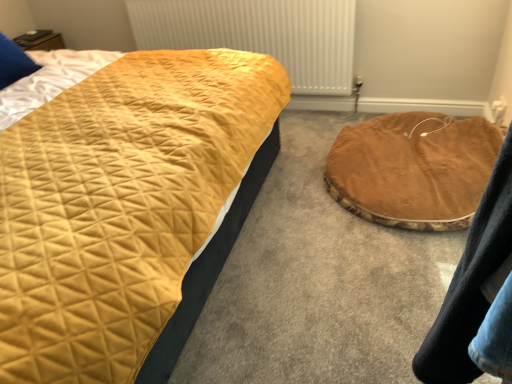
The width and height of the screenshot is (512, 384). What do you see at coordinates (413, 169) in the screenshot?
I see `brown velvety cat bed at lower right` at bounding box center [413, 169].

Identify the location of brown plush pet bed at center. (477, 295).

Can you confirm if brown plush pet bed at center is smaller than brown velvety cat bed at lower right?

Yes.

Can you confirm if brown plush pet bed at center is thinner than brown velvety cat bed at lower right?

Indeed, brown plush pet bed at center has a lesser width compared to brown velvety cat bed at lower right.

Which object is closer to the camera taking this photo, brown plush pet bed at center or brown velvety cat bed at lower right?

brown plush pet bed at center is more forward.

Is point (451, 215) positioned after point (474, 290)?

Yes, it is behind point (474, 290).

Does brown velvety cat bed at lower right lie in front of brown plush pet bed at center?

No, brown velvety cat bed at lower right is further to the viewer.

Where is `couple below the brown velvety cat bed at lower right (from the image's perspective)`? This screenshot has height=384, width=512. couple below the brown velvety cat bed at lower right (from the image's perspective) is located at coordinates (477, 295).

Find the location of `couple located in front of the metallic white radiator at upper center`. couple located in front of the metallic white radiator at upper center is located at coordinates (477, 295).

Which object is wider, brown plush pet bed at center or metallic white radiator at upper center?

brown plush pet bed at center is wider.

Is brown plush pet bed at center facing towards metallic white radiator at upper center?

Yes, brown plush pet bed at center faces towards metallic white radiator at upper center.

Is brown velvety cat bed at lower right aimed at metallic white radiator at upper center?

No.

Is brown velvety cat bed at lower right not inside metallic white radiator at upper center?

Absolutely, brown velvety cat bed at lower right is external to metallic white radiator at upper center.

From the image's perspective, does brown velvety cat bed at lower right appear lower than metallic white radiator at upper center?

Correct, brown velvety cat bed at lower right appears lower than metallic white radiator at upper center in the image.

Relative to metallic white radiator at upper center, is brown velvety cat bed at lower right in front or behind?

brown velvety cat bed at lower right is positioned closer to the viewer than metallic white radiator at upper center.

From a real-world perspective, is metallic white radiator at upper center positioned under brown plush pet bed at center based on gravity?

Yes, from a real-world perspective, metallic white radiator at upper center is under brown plush pet bed at center.

Is the surface of metallic white radiator at upper center in direct contact with brown plush pet bed at center?

No.

Locate an element on the screen. radiator behind the brown plush pet bed at center is located at coordinates (259, 34).

Considering the relative positions of metallic white radiator at upper center and brown plush pet bed at center in the image provided, is metallic white radiator at upper center to the left of brown plush pet bed at center from the viewer's perspective?

Indeed, metallic white radiator at upper center is positioned on the left side of brown plush pet bed at center.

Considering the relative sizes of metallic white radiator at upper center and brown velvety cat bed at lower right in the image provided, is metallic white radiator at upper center taller than brown velvety cat bed at lower right?

Indeed, metallic white radiator at upper center has a greater height compared to brown velvety cat bed at lower right.

Is metallic white radiator at upper center to the right of brown velvety cat bed at lower right from the viewer's perspective?

No, metallic white radiator at upper center is not to the right of brown velvety cat bed at lower right.

Which is correct: metallic white radiator at upper center is inside brown velvety cat bed at lower right, or outside of it?

metallic white radiator at upper center is spatially situated outside brown velvety cat bed at lower right.

Consider the image. Would you say metallic white radiator at upper center is a long distance from brown velvety cat bed at lower right?

metallic white radiator at upper center is near brown velvety cat bed at lower right, not far away.

You are a GUI agent. You are given a task and a screenshot of the screen. Output one action in this format:
    pyautogui.click(x=<x>, y=<y>)
    Task: Click on the cat bed to the right of brown plush pet bed at center
    Image resolution: width=512 pixels, height=384 pixels.
    Given the screenshot: What is the action you would take?
    pyautogui.click(x=413, y=169)

Locate an element on the screen. Image resolution: width=512 pixels, height=384 pixels. couple below the brown velvety cat bed at lower right (from the image's perspective) is located at coordinates (477, 295).

Based on their spatial positions, is brown plush pet bed at center or brown velvety cat bed at lower right further from metallic white radiator at upper center?

The object further to metallic white radiator at upper center is brown plush pet bed at center.

From the image, which object appears to be farther from brown plush pet bed at center, metallic white radiator at upper center or brown velvety cat bed at lower right?

Among the two, metallic white radiator at upper center is located further to brown plush pet bed at center.

Which object lies nearer to the anchor point brown plush pet bed at center, brown velvety cat bed at lower right or metallic white radiator at upper center?

The object closer to brown plush pet bed at center is brown velvety cat bed at lower right.

Consider the image. Which object lies nearer to the anchor point brown velvety cat bed at lower right, brown plush pet bed at center or metallic white radiator at upper center?

Among the two, metallic white radiator at upper center is located nearer to brown velvety cat bed at lower right.

From the image, which object appears to be farther from metallic white radiator at upper center, brown velvety cat bed at lower right or brown plush pet bed at center?

brown plush pet bed at center is positioned further to the anchor metallic white radiator at upper center.

Looking at the image, which one is located closer to brown velvety cat bed at lower right, metallic white radiator at upper center or brown plush pet bed at center?

metallic white radiator at upper center is closer to brown velvety cat bed at lower right.

Locate an element on the screen. cat bed between brown plush pet bed at center and metallic white radiator at upper center from front to back is located at coordinates (413, 169).